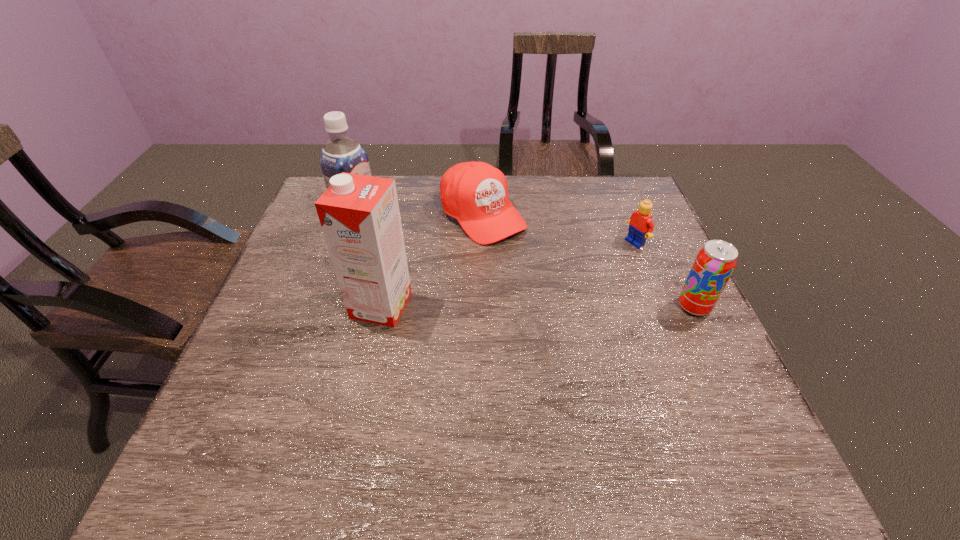
Locate an element on the screen. This screenshot has width=960, height=540. soda can located at the right edge is located at coordinates (715, 262).

Where is `Lego present at the right edge`? Lego present at the right edge is located at coordinates (641, 226).

What are the coordinates of `object located at the far left corner` in the screenshot? It's located at (340, 154).

Where is `vacant space at the far edge of the desktop`? The image size is (960, 540). vacant space at the far edge of the desktop is located at coordinates (430, 201).

This screenshot has height=540, width=960. What are the coordinates of `free space at the near edge` in the screenshot? It's located at (645, 424).

This screenshot has width=960, height=540. In order to click on vacant point at the left edge in this screenshot , I will do `click(273, 295)`.

Identify the location of vacant space at the right edge. This screenshot has width=960, height=540. tap(625, 291).

This screenshot has width=960, height=540. In the image, there is a desktop. Find the location of `vacant space at the far right corner`. vacant space at the far right corner is located at coordinates (632, 176).

You are a GUI agent. You are given a task and a screenshot of the screen. Output one action in this format:
    pyautogui.click(x=<x>, y=<y>)
    Task: Click on the vacant region between the carton and the Lego
    
    Given the screenshot: What is the action you would take?
    pyautogui.click(x=508, y=274)

In order to click on free space between the third object from left to right and the soda can in this screenshot , I will do `click(588, 261)`.